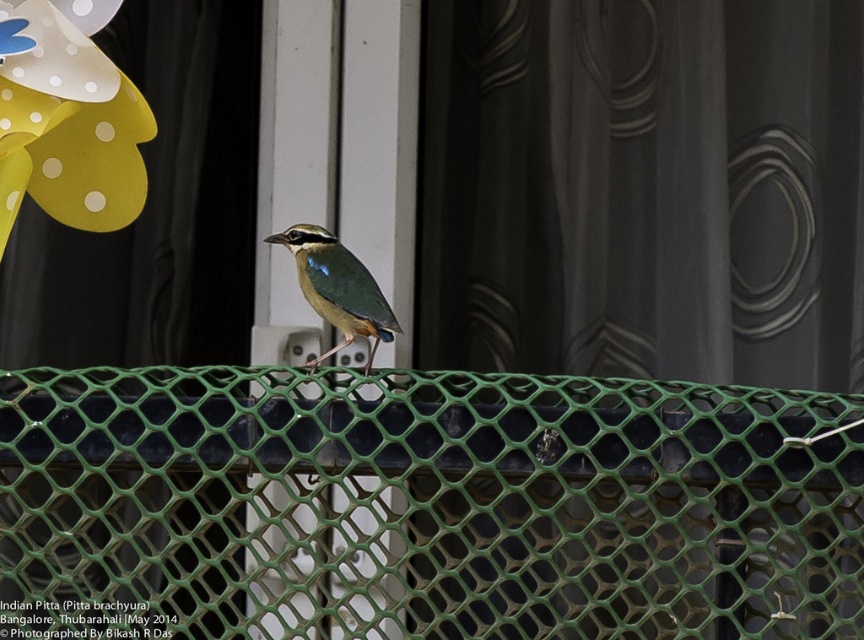
Question: Is yellow paper flower at upper left above shiny blue-green bird at center?

Choices:
 (A) yes
 (B) no

Answer: (A)

Question: Which of the following is the closest to the observer?

Choices:
 (A) green mesh fence at center
 (B) shiny blue-green bird at center
 (C) yellow paper flower at upper left
 (D) matte gray curtain at center

Answer: (A)

Question: Which object appears closest to the camera in this image?

Choices:
 (A) yellow paper flower at upper left
 (B) shiny blue-green bird at center

Answer: (B)

Question: Which of these objects is positioned farthest from the yellow paper flower at upper left?

Choices:
 (A) black fabric curtain at upper left
 (B) shiny blue-green bird at center
 (C) green mesh fence at center
 (D) matte gray curtain at center

Answer: (D)

Question: Is matte gray curtain at center smaller than black fabric curtain at upper left?

Choices:
 (A) no
 (B) yes

Answer: (A)

Question: Can you confirm if matte gray curtain at center is wider than black fabric curtain at upper left?

Choices:
 (A) yes
 (B) no

Answer: (A)